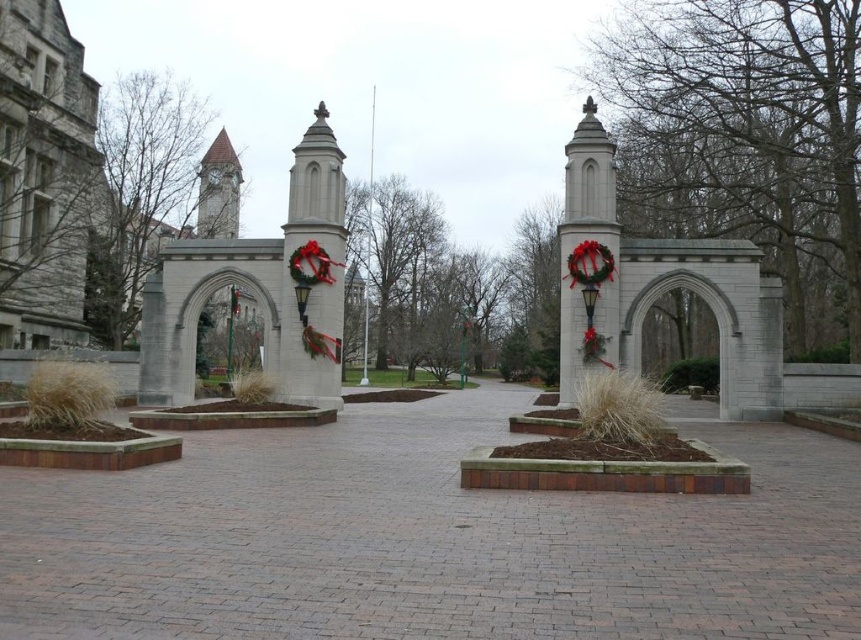
You are a visitor approaching the white stone archway at right and the brown stone clock tower at upper left. Which structure will you see first as you walk towards the entrance?

The white stone archway at right will be seen first because it is positioned in front of the brown stone clock tower at upper left, making it closer to your viewpoint.

You are standing in front of the symmetrical architectural structure with the two points marked. Which point, point (x=333, y=362) or point (x=773, y=396), is closer to you?

Point (x=333, y=362) is further to the camera than point (x=773, y=396), so the closer point to you is point (x=773, y=396).

You are a visitor at this university campus and want to take a photo of the white stone archway at right without including the brown stone clock tower at upper left in the frame. Is it possible to do so by adjusting your position?

The white stone archway at right is positioned under the brown stone clock tower at upper left, so if you move to the right side of the archway and angle the camera downward, you can exclude the clock tower from the frame.